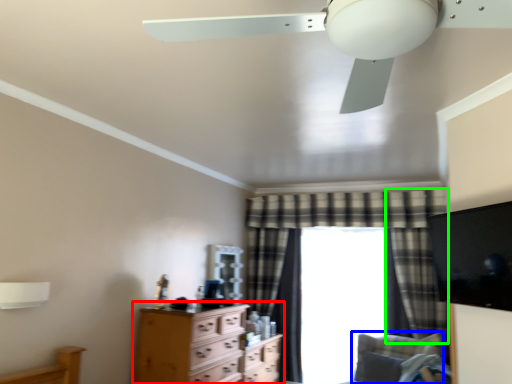
Question: Which object is the closest to the chest of drawers (highlighted by a red box)? Choose among these: swivel chair (highlighted by a blue box) or curtain (highlighted by a green box).

Choices:
 (A) swivel chair
 (B) curtain

Answer: (A)